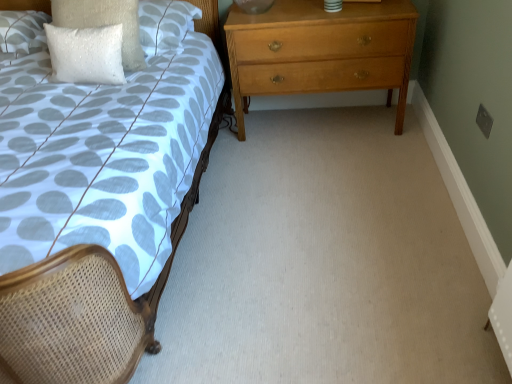
Question: From the image's perspective, relative to white sequined pillow at upper left, the 1th pillow when ordered from right to left, is matte woven bed at left above or below?

Choices:
 (A) above
 (B) below

Answer: (B)

Question: Is matte woven bed at left taller or shorter than white sequined pillow at upper left, the 1th pillow when ordered from right to left?

Choices:
 (A) tall
 (B) short

Answer: (A)

Question: Which object is positioned farthest from the matte woven bed at left?

Choices:
 (A) white textured pillow at upper left, the third pillow viewed from the right
 (B) white sequined pillow at upper left, arranged as the 2th pillow when viewed from the left
 (C) light brown wooden chest of drawers at right
 (D) white sequined pillow at upper left, the 1th pillow when ordered from right to left

Answer: (A)

Question: Estimate the real-world distances between objects in this image. Which object is closer to the white textured pillow at upper left, the third pillow viewed from the right?

Choices:
 (A) light brown wooden chest of drawers at right
 (B) white sequined pillow at upper left, the 1th pillow when ordered from right to left
 (C) white sequined pillow at upper left, the 2th pillow positioned from the right
 (D) matte woven bed at left

Answer: (C)